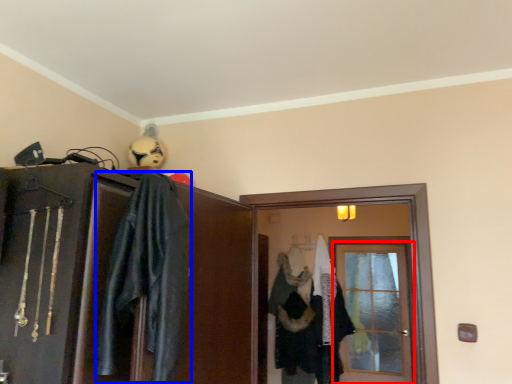
Question: Which of the following is the closest to the observer, door (highlighted by a red box) or costume (highlighted by a blue box)?

Choices:
 (A) door
 (B) costume

Answer: (B)